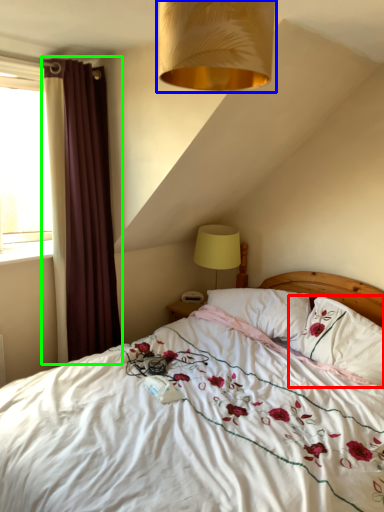
Question: Which is farther away from pillow (highlighted by a red box)? lamp (highlighted by a blue box) or curtain (highlighted by a green box)?

Choices:
 (A) lamp
 (B) curtain

Answer: (A)